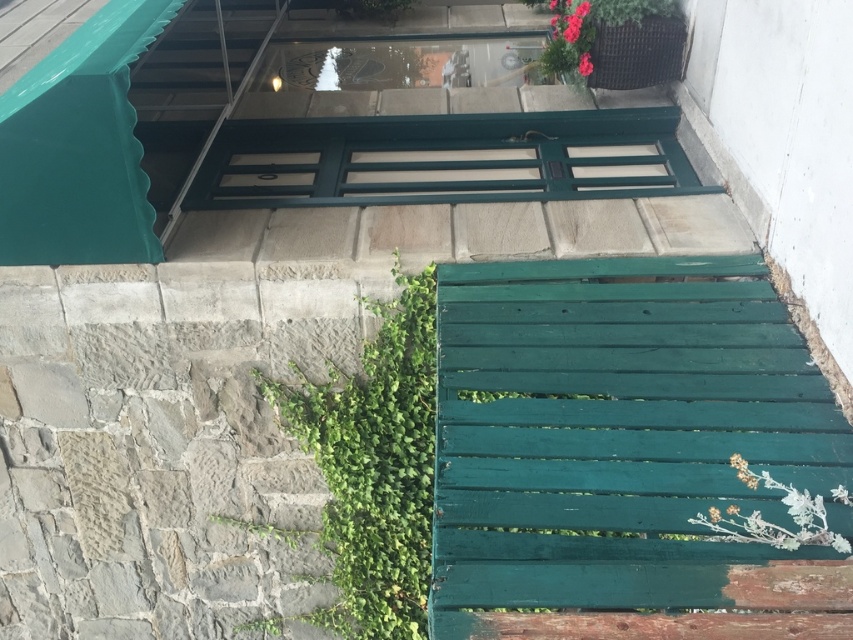
Question: Where is matte black planter at upper right located in relation to green wooden plant at lower right in the image?

Choices:
 (A) below
 (B) above

Answer: (B)

Question: Which of the following is the farthest from the observer?

Choices:
 (A) green wooden plant at lower right
 (B) matte black planter at upper right

Answer: (B)

Question: Which of the following is the farthest from the observer?

Choices:
 (A) (556, 35)
 (B) (257, 524)
 (C) (619, 19)
 (D) (412, 632)

Answer: (A)

Question: Does matte black planter at upper right appear over green textured planter at upper right?

Choices:
 (A) yes
 (B) no

Answer: (B)

Question: Estimate the real-world distances between objects in this image. Which object is farther from the green leafy plant at center?

Choices:
 (A) green leafy plant at lower left
 (B) matte black planter at upper right
 (C) green textured planter at upper right
 (D) green wooden plant at lower right

Answer: (C)

Question: Does green leafy plant at center appear over matte black planter at upper right?

Choices:
 (A) no
 (B) yes

Answer: (A)